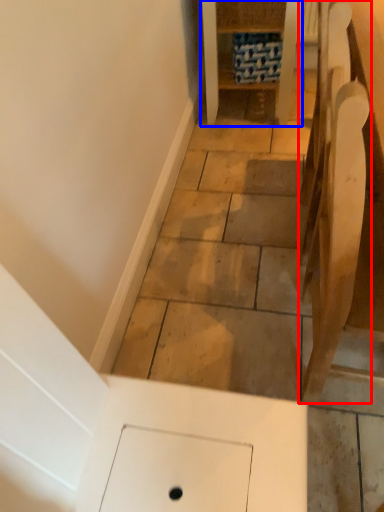
Question: Among these objects, which one is farthest to the camera, furniture (highlighted by a red box) or furniture (highlighted by a blue box)?

Choices:
 (A) furniture
 (B) furniture

Answer: (B)